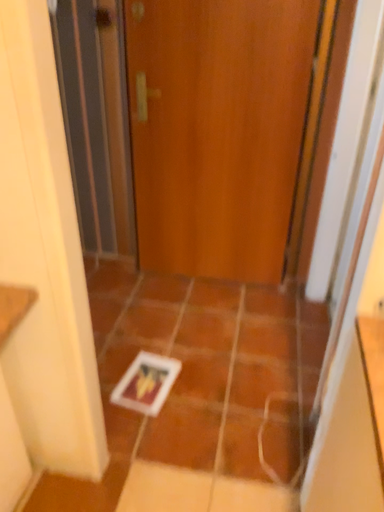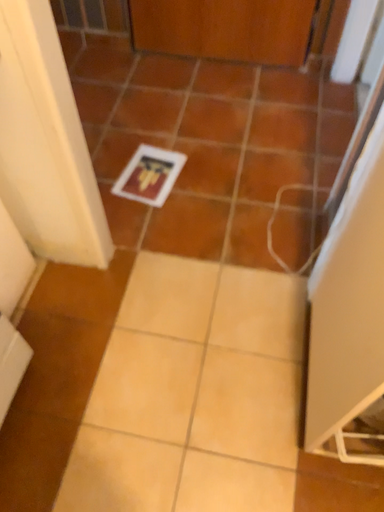
Question: Which way did the camera rotate in the video?

Choices:
 (A) rotated upward
 (B) rotated downward

Answer: (B)